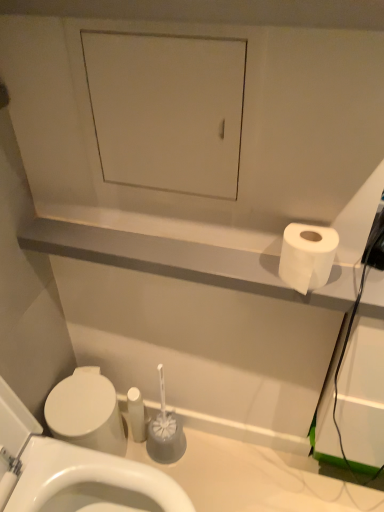
Question: Do you think white matte toilet paper at right is within white matte cabinet at upper center, or outside of it?

Choices:
 (A) inside
 (B) outside

Answer: (B)

Question: From a real-world perspective, is white matte toilet paper at right above or below white matte cabinet at upper center?

Choices:
 (A) below
 (B) above

Answer: (A)

Question: Which object is the farthest from the white matte toilet paper at right?

Choices:
 (A) white glossy toilet at lower left
 (B) white matte cabinet at upper center

Answer: (A)

Question: Which object is the closest to the white glossy toilet at lower left?

Choices:
 (A) white matte toilet paper at right
 (B) white matte cabinet at upper center

Answer: (A)